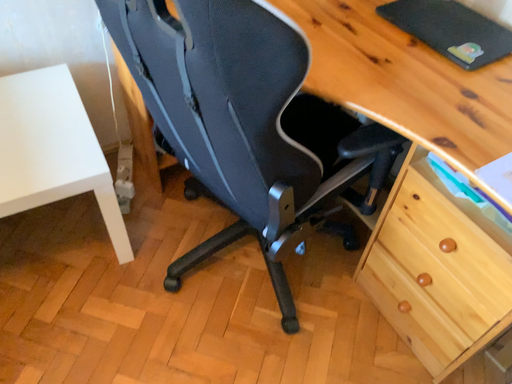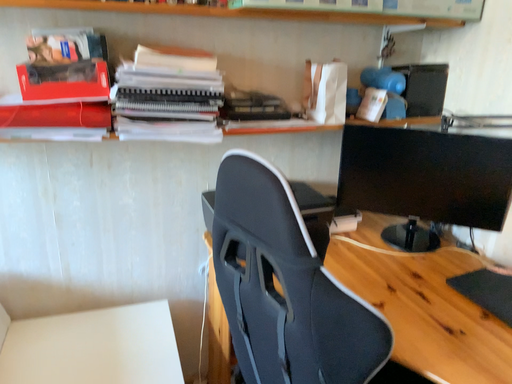
Question: Which way did the camera rotate in the video?

Choices:
 (A) rotated upward
 (B) rotated downward

Answer: (A)